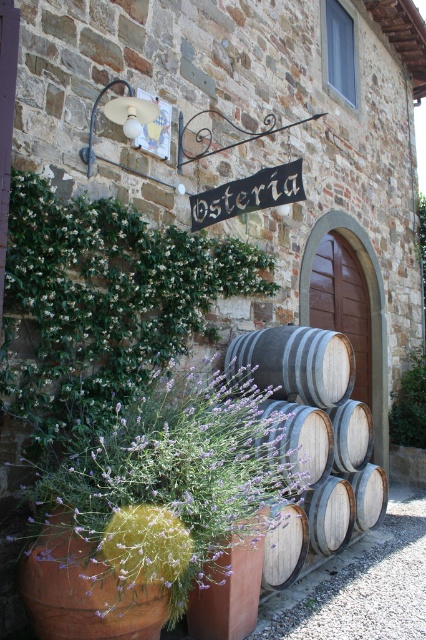
Which is above, purple soft-textured plant at lower left or gray wooden barrel at center?

purple soft-textured plant at lower left is higher up.

Can you confirm if purple soft-textured plant at lower left is bigger than gray wooden barrel at center?

Indeed, purple soft-textured plant at lower left has a larger size compared to gray wooden barrel at center.

This screenshot has height=640, width=426. Describe the element at coordinates (155, 508) in the screenshot. I see `purple soft-textured plant at lower left` at that location.

Locate an element on the screen. The width and height of the screenshot is (426, 640). purple soft-textured plant at lower left is located at coordinates (155, 508).

Between gray wooden barrel at center and green leafy plant at right, which one is positioned higher?

gray wooden barrel at center is above.

Which is more to the left, gray wooden barrel at center or green leafy plant at right?

From the viewer's perspective, gray wooden barrel at center appears more on the left side.

Locate an element on the screen. The height and width of the screenshot is (640, 426). gray wooden barrel at center is located at coordinates (317, 426).

This screenshot has height=640, width=426. Identify the location of gray wooden barrel at center. (317, 426).

Who is more forward, [210,588] or [396,435]?

Point [210,588] is more forward.

Can you confirm if purple soft-textured plant at lower left is smaller than green leafy plant at right?

No, purple soft-textured plant at lower left is not smaller than green leafy plant at right.

Who is more distant from viewer, (206,509) or (423,422)?

The point (423,422) is more distant.

Where is `purple soft-textured plant at lower left`? This screenshot has width=426, height=640. purple soft-textured plant at lower left is located at coordinates (155, 508).